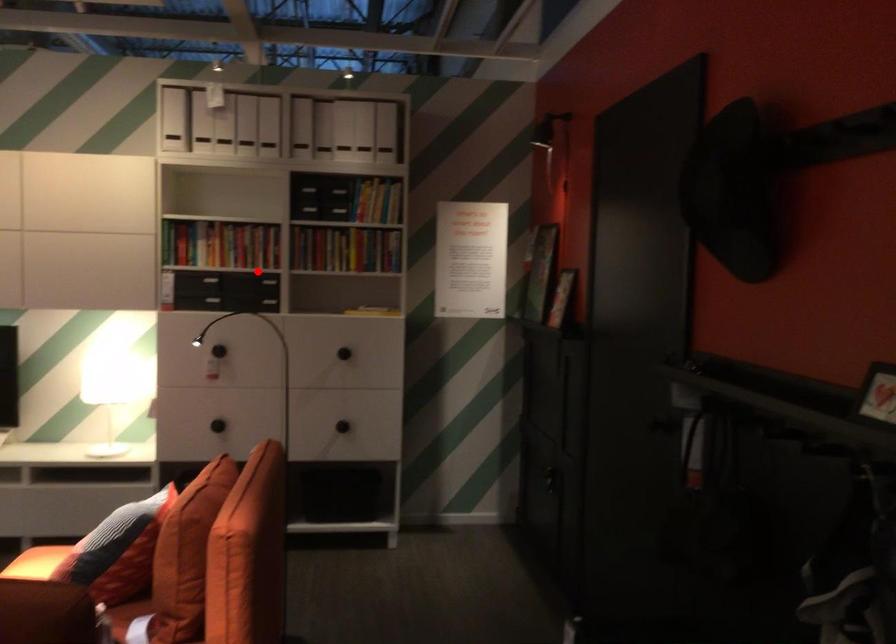
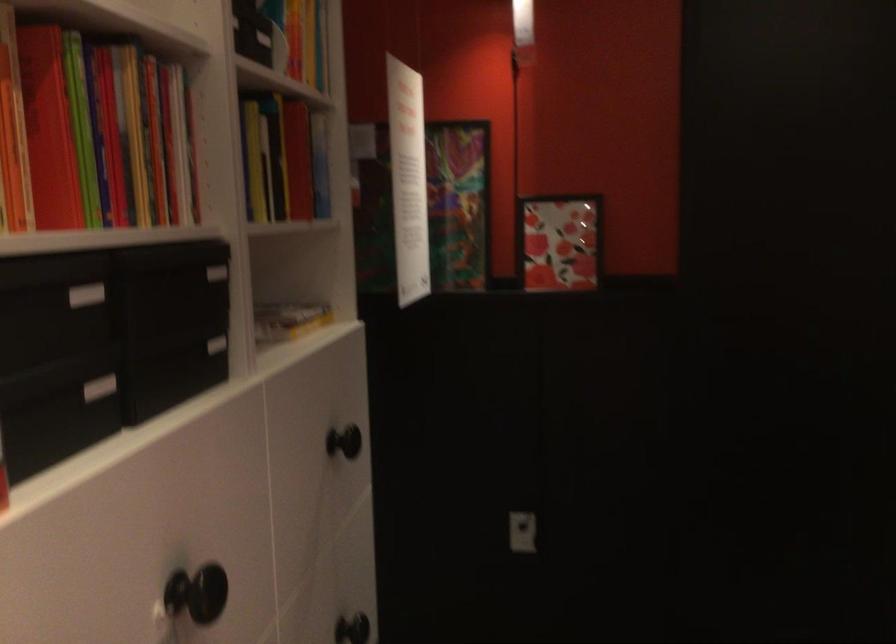
In the second image, find the point that corresponds to the highlighted location in the first image.

(216, 272)